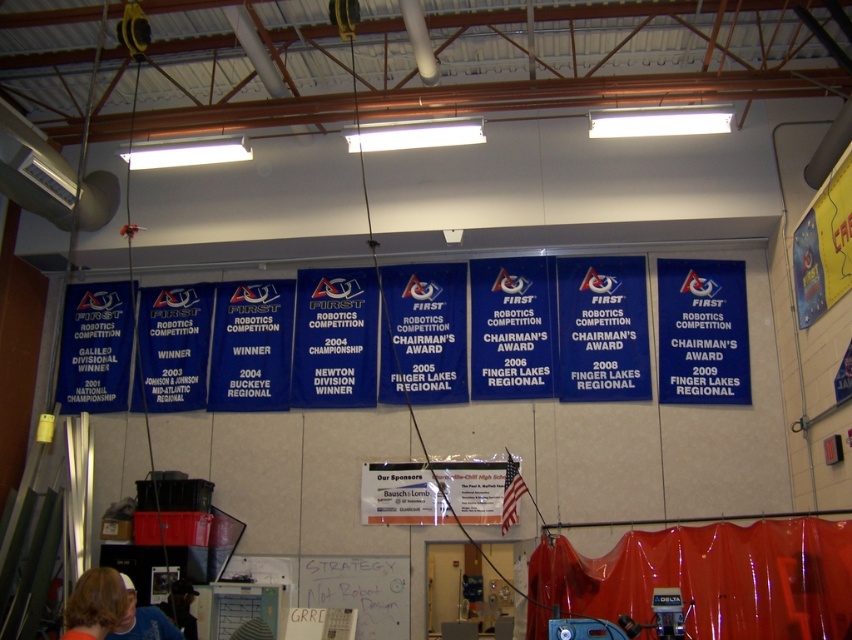
You are standing in the workshop and notice a point marked at coordinates (701, 332). Based on the scene description, can you determine which object this point is located on?

The point at coordinates (701, 332) is located on the blue fabric banner at center right.